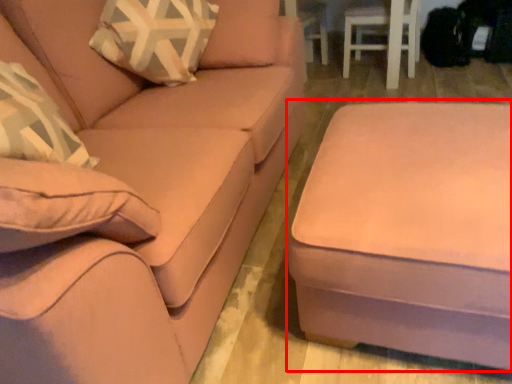
Question: From the image's perspective, what is the correct spatial positioning of table (annotated by the red box) in reference to studio couch?

Choices:
 (A) above
 (B) below

Answer: (B)